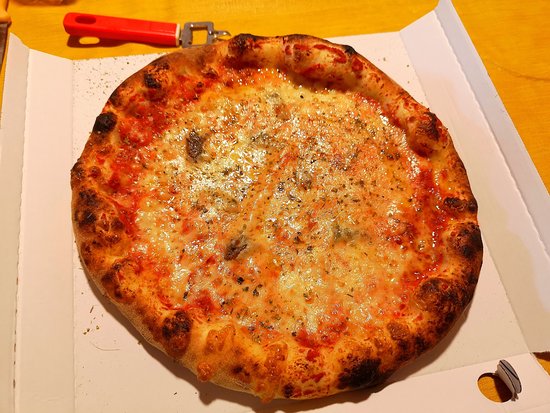
The height and width of the screenshot is (413, 550). What are the coordinates of `tabletop` in the screenshot? It's located at (499, 35).